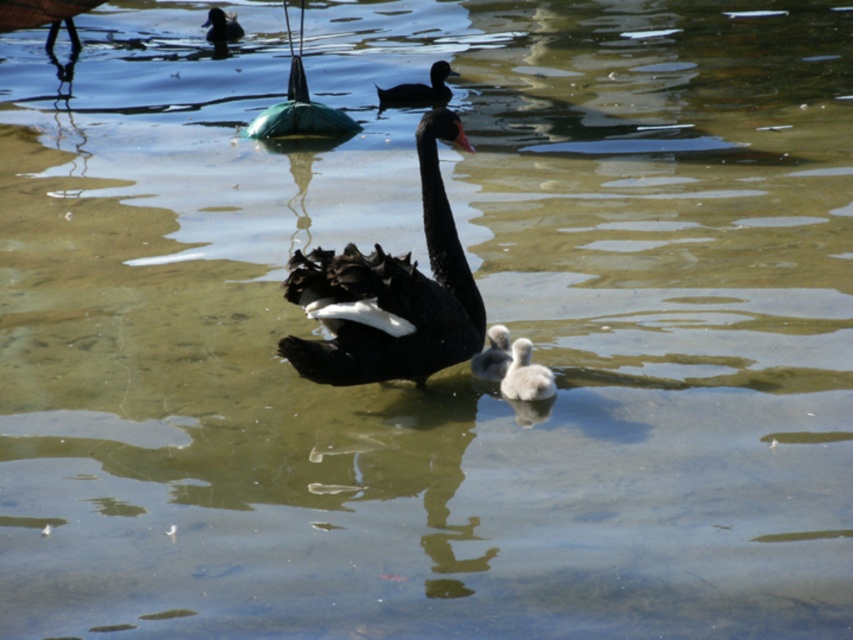
Question: Which object is farther from the camera taking this photo?

Choices:
 (A) black glossy goose at center
 (B) white fluffy duckling at center
 (C) black matte duck at upper center
 (D) black glossy duck at upper left

Answer: (D)

Question: Estimate the real-world distances between objects in this image. Which object is closer to the black matte duck at upper center?

Choices:
 (A) white fluffy duckling at center
 (B) black glossy duck at upper left
 (C) black matte beak at upper center
 (D) white fluffy goose at center

Answer: (B)

Question: Which object appears farthest from the camera in this image?

Choices:
 (A) white fluffy goose at center
 (B) black matte beak at upper center

Answer: (A)

Question: Does black glossy goose at center have a larger size compared to white fluffy duckling at center?

Choices:
 (A) yes
 (B) no

Answer: (A)

Question: Can you confirm if white fluffy duckling at center is positioned to the left of black glossy duck at upper left?

Choices:
 (A) no
 (B) yes

Answer: (A)

Question: Can you confirm if black matte duck at upper center is positioned below white fluffy goose at center?

Choices:
 (A) yes
 (B) no

Answer: (B)